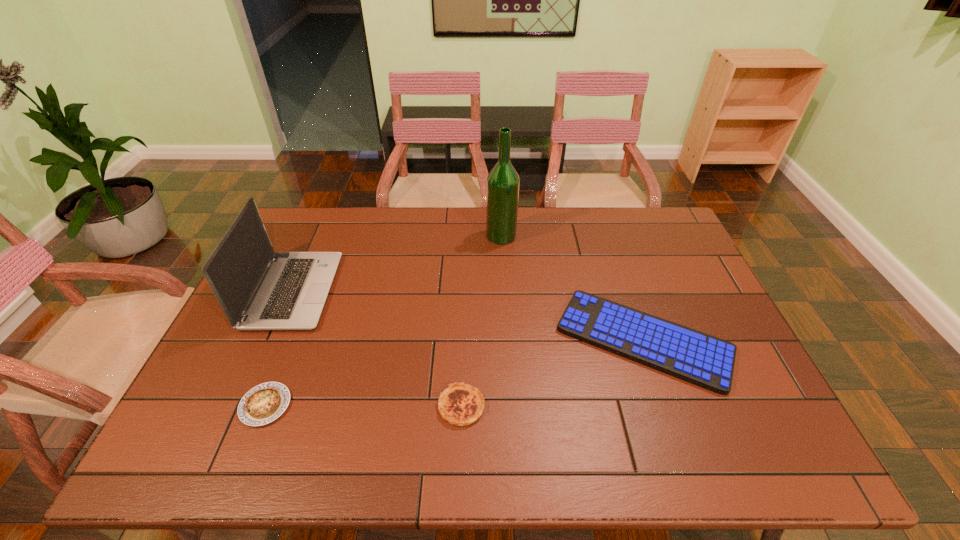
The image size is (960, 540). Find the location of `free space between the laptop computer and the left quiche`. free space between the laptop computer and the left quiche is located at coordinates (279, 348).

The image size is (960, 540). What are the coordinates of `the closest object to the left quiche` in the screenshot? It's located at (258, 289).

Select which object is the fourth closest to the right quiche. Please provide its 2D coordinates. Your answer should be formatted as a tuple, i.e. [(x, y)], where the tuple contains the x and y coordinates of a point satisfying the conditions above.

[(503, 182)]

Image resolution: width=960 pixels, height=540 pixels. Identify the location of vacant region that satisfies the following two spatial constraints: 1. on the screen of the third object from right to left; 2. on the right side of the laptop computer. (244, 406).

Where is `vacant space that satisfies the following two spatial constraints: 1. on the screen of the fourth shortest object; 2. on the right side of the computer keyboard`? This screenshot has height=540, width=960. vacant space that satisfies the following two spatial constraints: 1. on the screen of the fourth shortest object; 2. on the right side of the computer keyboard is located at coordinates (273, 340).

At what (x,y) coordinates should I click in order to perform the action: click on vacant space that satisfies the following two spatial constraints: 1. on the screen of the rightmost object; 2. on the left side of the laptop computer. Please return your answer as a coordinate pair (x, y). This screenshot has height=540, width=960. Looking at the image, I should click on (273, 340).

Find the location of a particular element. vacant space that satisfies the following two spatial constraints: 1. on the screen of the second tallest object; 2. on the back side of the left quiche is located at coordinates (244, 405).

This screenshot has height=540, width=960. I want to click on vacant point that satisfies the following two spatial constraints: 1. on the screen of the rightmost object; 2. on the left side of the fourth shortest object, so click(273, 340).

Find the location of a particular element. Image resolution: width=960 pixels, height=540 pixels. free space that satisfies the following two spatial constraints: 1. on the back side of the third object from right to left; 2. on the screen of the laptop computer is located at coordinates (466, 291).